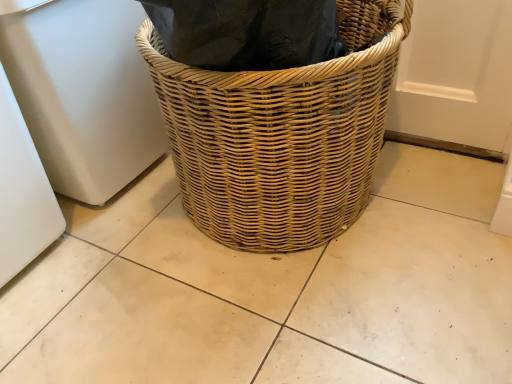
Question: Does natural woven basket at center appear on the right side of white matte refrigerator at left?

Choices:
 (A) yes
 (B) no

Answer: (A)

Question: Is natural woven basket at center positioned beyond the bounds of white matte refrigerator at left?

Choices:
 (A) yes
 (B) no

Answer: (A)

Question: Considering the relative sizes of natural woven basket at center and white matte refrigerator at left in the image provided, is natural woven basket at center bigger than white matte refrigerator at left?

Choices:
 (A) yes
 (B) no

Answer: (A)

Question: Is the position of natural woven basket at center less distant than that of white matte refrigerator at left?

Choices:
 (A) yes
 (B) no

Answer: (A)

Question: Is natural woven basket at center facing towards white matte refrigerator at left?

Choices:
 (A) no
 (B) yes

Answer: (A)

Question: Is white matte refrigerator at left inside natural woven basket at center?

Choices:
 (A) yes
 (B) no

Answer: (B)

Question: Is white matte refrigerator at left located outside natural woven basket at center?

Choices:
 (A) yes
 (B) no

Answer: (A)

Question: Is white matte refrigerator at left behind natural woven basket at center?

Choices:
 (A) yes
 (B) no

Answer: (A)

Question: Considering the relative sizes of white matte refrigerator at left and natural woven basket at center in the image provided, is white matte refrigerator at left thinner than natural woven basket at center?

Choices:
 (A) yes
 (B) no

Answer: (A)

Question: Can you confirm if white matte refrigerator at left is bigger than natural woven basket at center?

Choices:
 (A) no
 (B) yes

Answer: (A)

Question: Does white matte refrigerator at left appear on the right side of natural woven basket at center?

Choices:
 (A) yes
 (B) no

Answer: (B)

Question: Considering the relative sizes of white matte refrigerator at left and natural woven basket at center in the image provided, is white matte refrigerator at left shorter than natural woven basket at center?

Choices:
 (A) no
 (B) yes

Answer: (A)

Question: Considering the positions of natural woven basket at center and white matte refrigerator at left in the image, is natural woven basket at center wider or thinner than white matte refrigerator at left?

Choices:
 (A) thin
 (B) wide

Answer: (B)